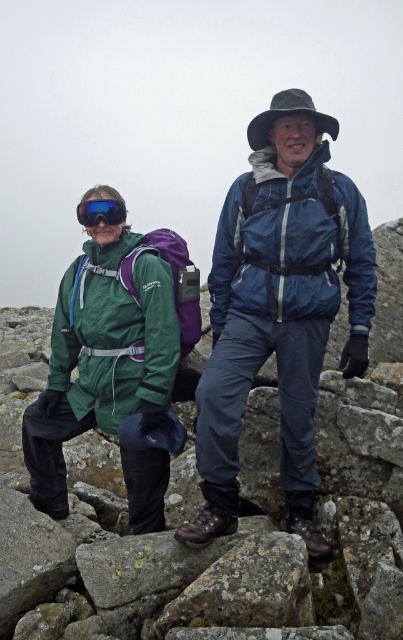
You are a photographer trying to capture a clear shot of the blue reflective goggles at center. The green waterproof jacket at left is blocking your view. Can you estimate whether the jacket is tall enough to obstruct the goggles from your current angle?

The green waterproof jacket at left has a greater height compared to blue reflective goggles at center, so yes, the jacket is tall enough to obstruct the goggles from your current angle.

You are a photographer trying to capture a clear shot of both the green waterproof jacket at center and the blue reflective goggles at center. Since you want to ensure both are in focus, you need to know which object is wider. Can you tell me which one is wider?

The green waterproof jacket at center is wider than the blue reflective goggles at center.